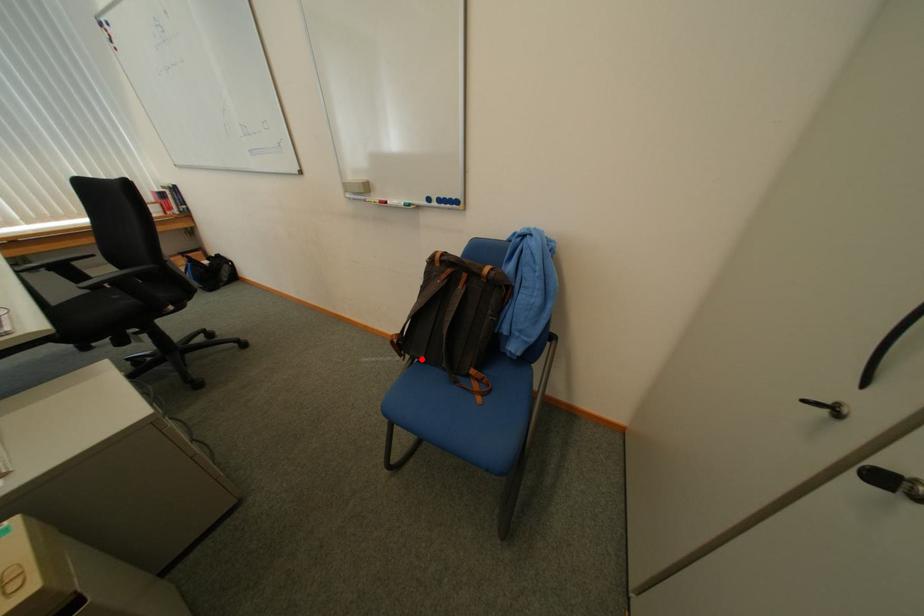
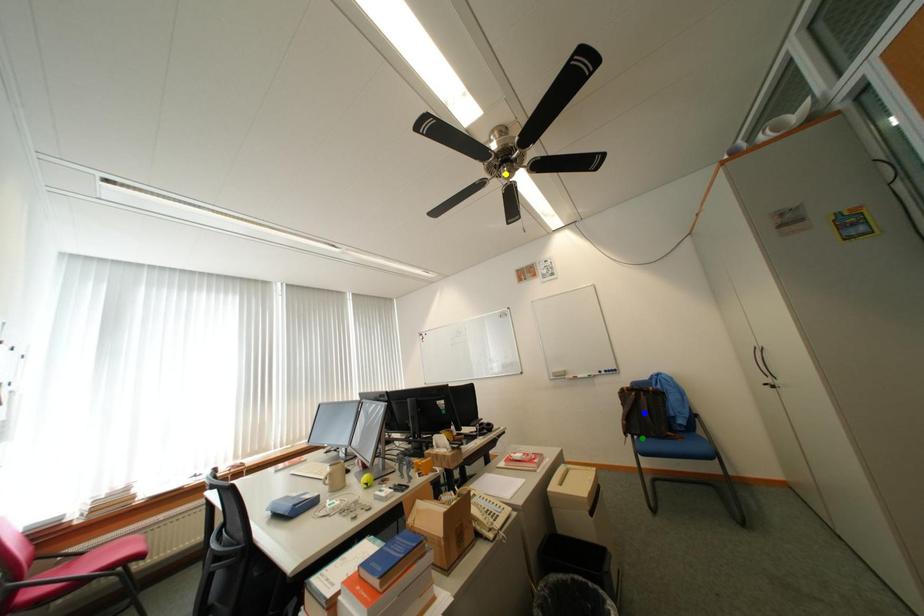
Question: I am providing you with two images of the same scene from different viewpoints. A red point is marked on the first image. You are given multiple points on the second image. Which point in image 2 is actually the same real-world point as the red point in image 1?

Choices:
 (A) green point
 (B) yellow point
 (C) blue point

Answer: (A)